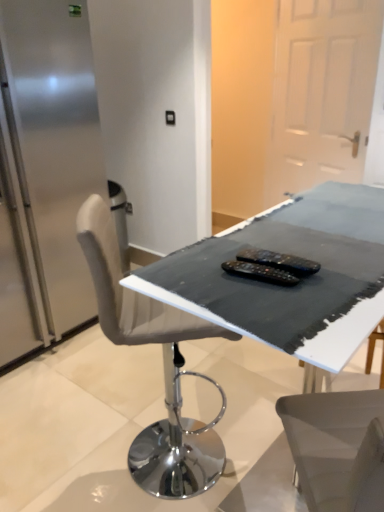
This screenshot has width=384, height=512. What are the coordinates of `vacant space to the left of black plastic remote controls at center, the 1th equipment viewed from the top` in the screenshot? It's located at (200, 270).